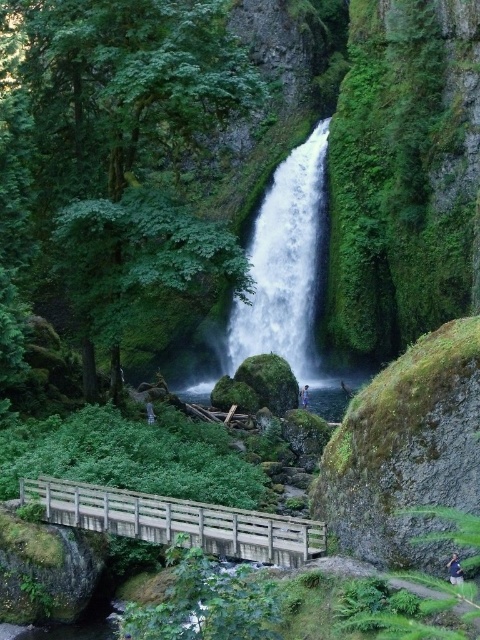
Does white smooth waterfall at center appear on the right side of wooden bridge at lower center?

Indeed, white smooth waterfall at center is positioned on the right side of wooden bridge at lower center.

Can you confirm if white smooth waterfall at center is positioned to the left of wooden bridge at lower center?

In fact, white smooth waterfall at center is to the right of wooden bridge at lower center.

Which is in front, point (309, 288) or point (151, 493)?

Positioned in front is point (151, 493).

Locate an element on the screen. This screenshot has height=640, width=480. white smooth waterfall at center is located at coordinates (284, 262).

Between wooden bridge at lower center and light blue denim jeans at center, which one appears on the left side from the viewer's perspective?

Positioned to the left is wooden bridge at lower center.

Is wooden bridge at lower center positioned at the back of light blue denim jeans at center?

No, wooden bridge at lower center is closer to the viewer.

Who is more distant from viewer, (x=60, y=497) or (x=308, y=392)?

The point (x=308, y=392) is more distant.

The height and width of the screenshot is (640, 480). I want to click on wooden bridge at lower center, so click(178, 522).

Does point (312, 202) come behind point (303, 397)?

Yes, point (312, 202) is behind point (303, 397).

Does white smooth waterfall at center appear over light blue denim jeans at center?

Indeed, white smooth waterfall at center is positioned over light blue denim jeans at center.

Which is behind, point (271, 262) or point (305, 403)?

The point (271, 262) is more distant.

Find the location of `white smooth waterfall at center`. white smooth waterfall at center is located at coordinates (284, 262).